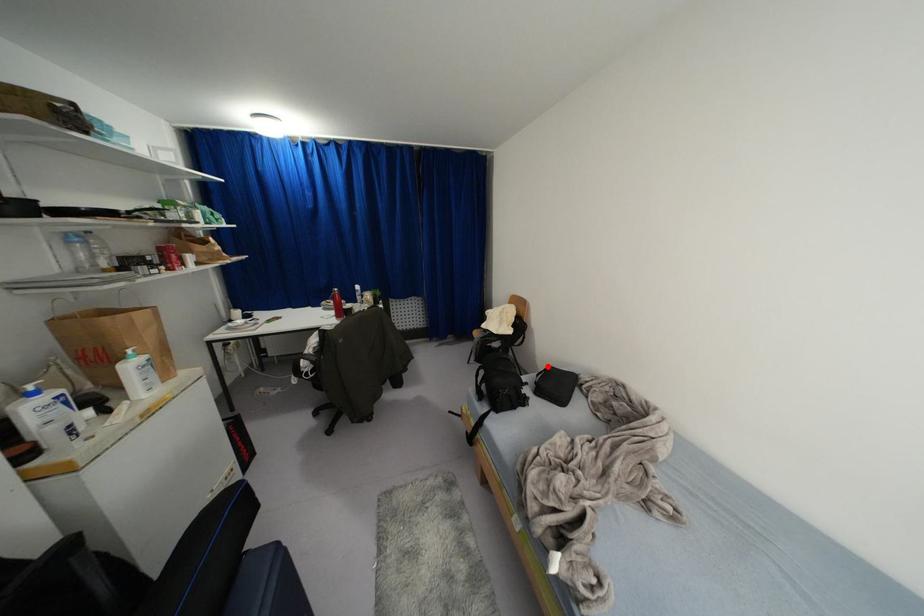
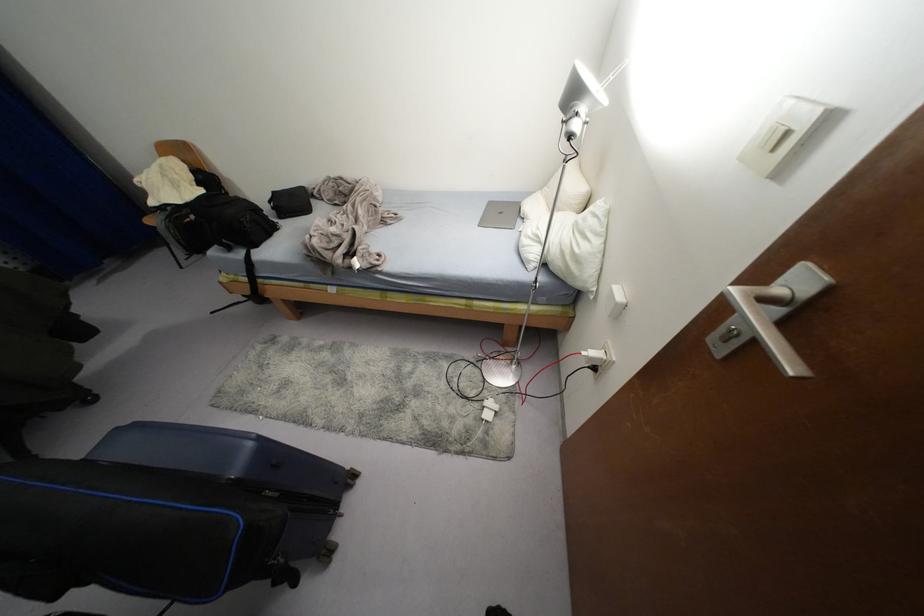
Find the pixel in the second image that matches the highlighted location in the first image.

(274, 192)